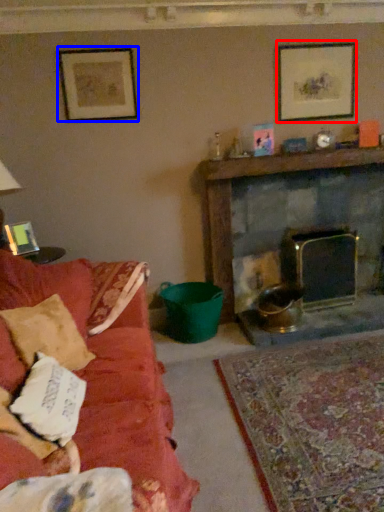
Question: Which point is further to the camera, picture frame (highlighted by a red box) or picture frame (highlighted by a blue box)?

Choices:
 (A) picture frame
 (B) picture frame

Answer: (A)